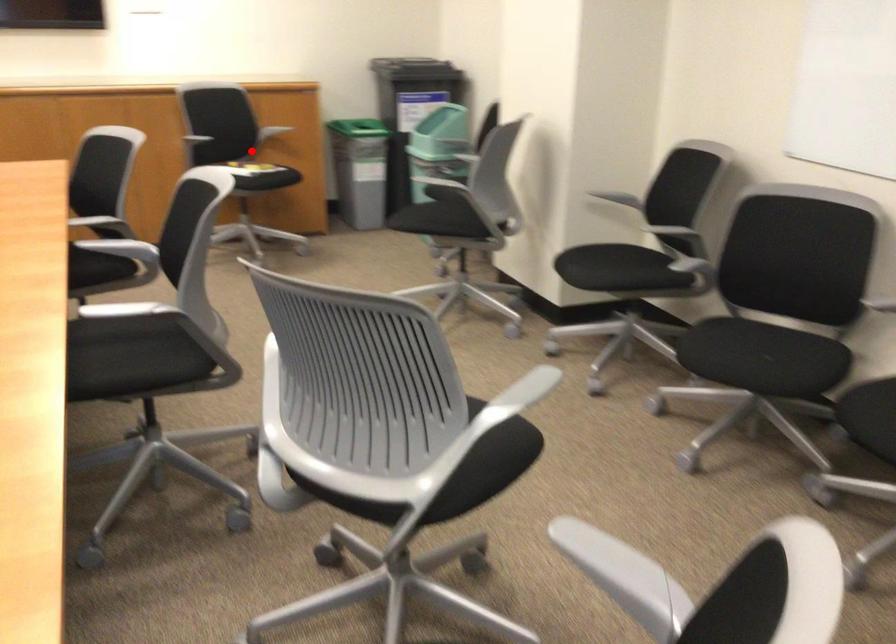
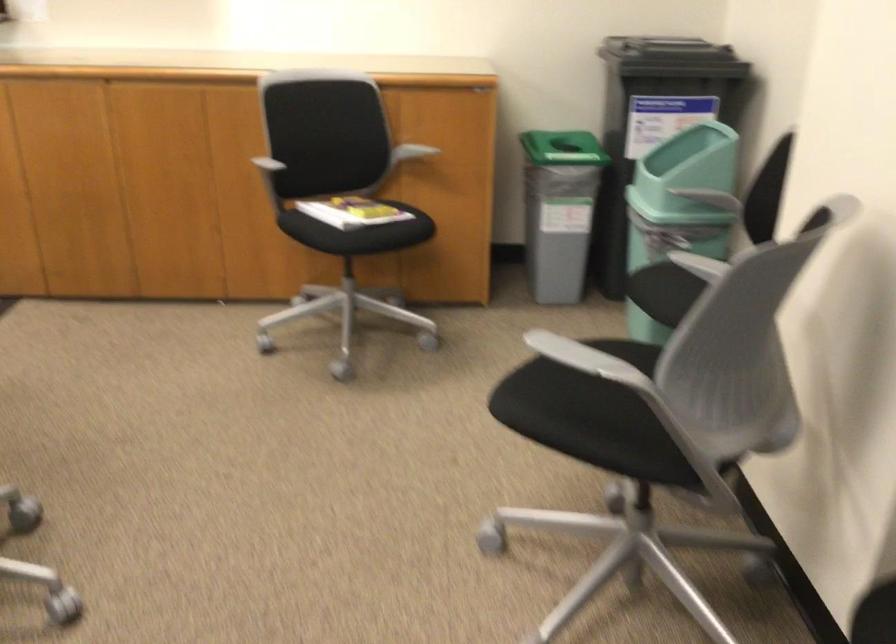
Find the pixel in the second image that matches the highlighted location in the first image.

(351, 211)